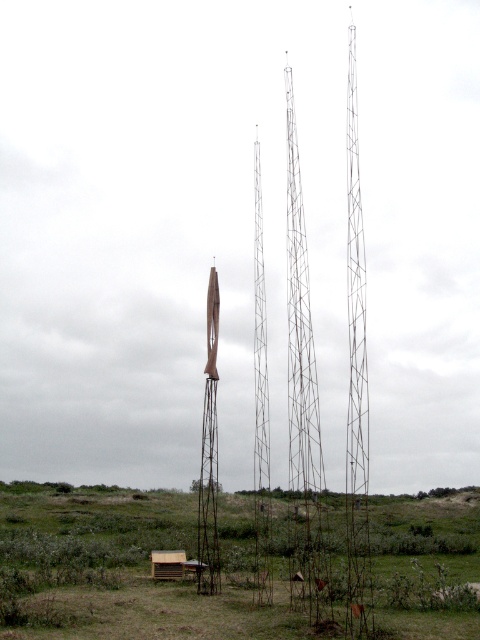
Looking at this image, between metallic grid tower at center and shiny metallic rocket at center, which one has less height?

shiny metallic rocket at center

Does metallic grid tower at center appear on the right side of shiny metallic rocket at center?

Correct, you'll find metallic grid tower at center to the right of shiny metallic rocket at center.

Who is more distant from viewer, (305,440) or (207,326)?

The point (207,326) is more distant.

At what (x,y) coordinates should I click in order to perform the action: click on metallic grid tower at center. Please return your answer as a coordinate pair (x, y). This screenshot has width=480, height=640. Looking at the image, I should click on (300, 326).